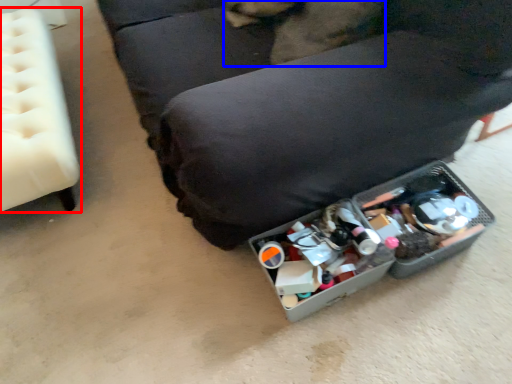
Question: Which of the following is the closest to the observer, furniture (highlighted by a red box) or animal (highlighted by a blue box)?

Choices:
 (A) furniture
 (B) animal

Answer: (B)